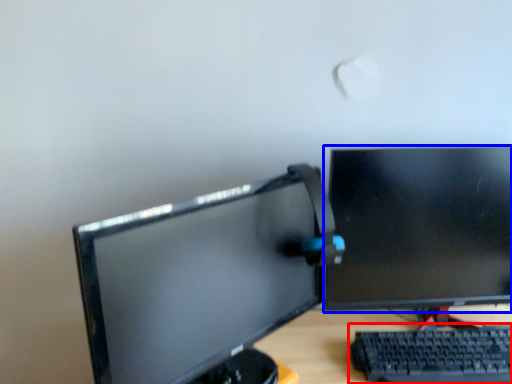
Question: Which point is closer to the camera, computer keyboard (highlighted by a red box) or computer monitor (highlighted by a blue box)?

Choices:
 (A) computer keyboard
 (B) computer monitor

Answer: (A)